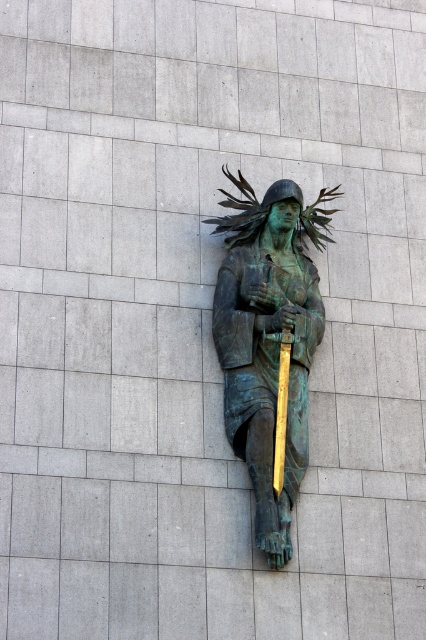
You are an art conservator assessing the space between the green patina bronze statue at center and the gold polished spear at center. Can you determine if the statue is wider than the spear?

The green patina bronze statue at center might be wider than gold polished spear at center according to the description.

You are an art conservator standing at the center of the room. You need to place a protective barrier around the green patina bronze statue at center. The barrier must be placed exactly 1 meter away from the statue in all directions. What are the coordinates of the four corners of the barrier if the room uses a coordinate system where the bottom left corner is the origin?

The coordinates of the four corners of the barrier would be approximately at points A, B, C, D. However, without knowing the scale of the coordinate system or the room dimensions, it is impossible to provide exact coordinates. The barrier should be placed 1 meter away from the statue at point (268, 339) in all directions.

From the picture: You are an interior designer planning to place a new floor lamp in the room where the green patina bronze statue at center and the gold polished spear at center are displayed. The lamp needs to be shorter than the statue but taller than the spear. Can you confirm if the statue is significantly taller than the spear to accommodate this requirement?

Answer: The green patina bronze statue at center is much taller than the gold polished spear at center, so yes, the lamp can be placed as it can be shorter than the statue but still taller than the spear.